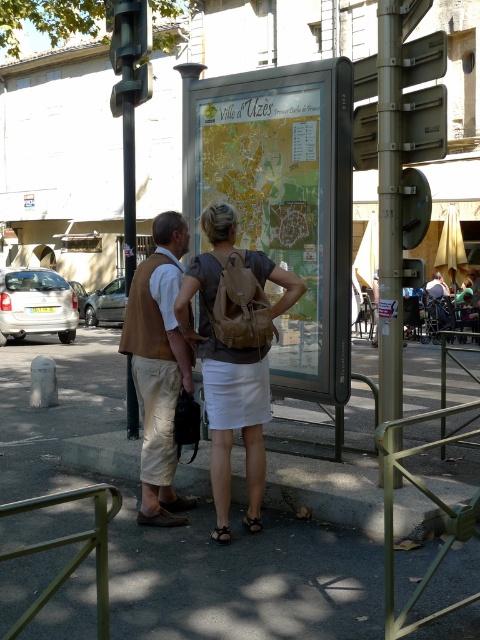
Can you confirm if gray asphalt pavement at center is positioned above metallic silver sign at upper right?

No.

Between gray asphalt pavement at center and metallic silver sign at upper right, which one has more height?

Standing taller between the two is gray asphalt pavement at center.

Does point (110, 406) come in front of point (430, 64)?

No, it is behind (430, 64).

Where is `gray asphalt pavement at center`? gray asphalt pavement at center is located at coordinates (182, 525).

Can you confirm if brown backpack at center is taller than metallic silver sign at upper right?

Indeed, brown backpack at center has a greater height compared to metallic silver sign at upper right.

Does brown backpack at center lie in front of metallic silver sign at upper right?

Yes.

Who is more forward, [212,339] or [402,77]?

Point [212,339]

Find the location of `brown backpack at center`. brown backpack at center is located at coordinates (233, 352).

Is brown backpack at center positioned at the back of gold metallic pole at right?

No, brown backpack at center is in front of gold metallic pole at right.

Is point (259, 401) more distant than point (399, 67)?

That is False.

Locate an element on the screen. The width and height of the screenshot is (480, 640). brown backpack at center is located at coordinates (233, 352).